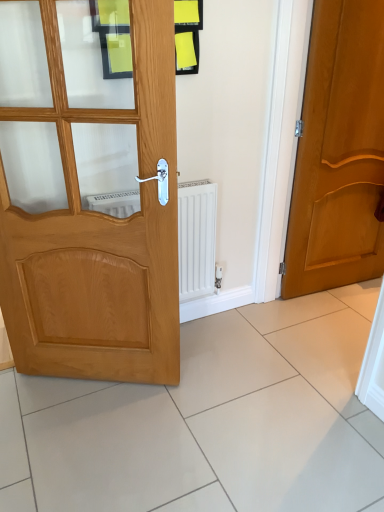
Question: Is light brown wood door at left, which ranks as the second door in back-to-front order, to the right of white glossy tile at lower right from the viewer's perspective?

Choices:
 (A) no
 (B) yes

Answer: (A)

Question: Does light brown wood door at left, the first door viewed from the left, have a larger size compared to white glossy tile at lower right?

Choices:
 (A) no
 (B) yes

Answer: (B)

Question: Is light brown wood door at left, which ranks as the second door in back-to-front order, smaller than white glossy tile at lower right?

Choices:
 (A) yes
 (B) no

Answer: (B)

Question: Is white glossy tile at lower right at the back of light brown wood door at left, which ranks as the second door in back-to-front order?

Choices:
 (A) no
 (B) yes

Answer: (A)

Question: From a real-world perspective, is light brown wood door at left, the first door viewed from the left, beneath white glossy tile at lower right?

Choices:
 (A) no
 (B) yes

Answer: (A)

Question: Considering the relative sizes of light brown wood door at left, the first door viewed from the left, and white glossy tile at lower right in the image provided, is light brown wood door at left, the first door viewed from the left, taller than white glossy tile at lower right?

Choices:
 (A) no
 (B) yes

Answer: (B)

Question: Is white glossy tile at lower right completely or partially inside matte wood door at right, acting as the 1th door starting from the back?

Choices:
 (A) no
 (B) yes

Answer: (A)

Question: Considering the relative sizes of matte wood door at right, marked as the 2th door in a front-to-back arrangement, and white glossy tile at lower right in the image provided, is matte wood door at right, marked as the 2th door in a front-to-back arrangement, thinner than white glossy tile at lower right?

Choices:
 (A) no
 (B) yes

Answer: (B)

Question: Is matte wood door at right, which is counted as the second door, starting from the left, at the left side of white glossy tile at lower right?

Choices:
 (A) yes
 (B) no

Answer: (A)

Question: From the image's perspective, is matte wood door at right, acting as the 1th door starting from the back, on white glossy tile at lower right?

Choices:
 (A) yes
 (B) no

Answer: (A)

Question: Considering the relative positions of matte wood door at right, marked as the 2th door in a front-to-back arrangement, and white glossy tile at lower right in the image provided, is matte wood door at right, marked as the 2th door in a front-to-back arrangement, to the right of white glossy tile at lower right from the viewer's perspective?

Choices:
 (A) no
 (B) yes

Answer: (A)

Question: Is matte wood door at right, marked as the 2th door in a front-to-back arrangement, turned away from white glossy tile at lower right?

Choices:
 (A) no
 (B) yes

Answer: (A)

Question: From the image's perspective, is white glossy tile at lower right located above matte wood door at right, marked as the 2th door in a front-to-back arrangement?

Choices:
 (A) no
 (B) yes

Answer: (A)